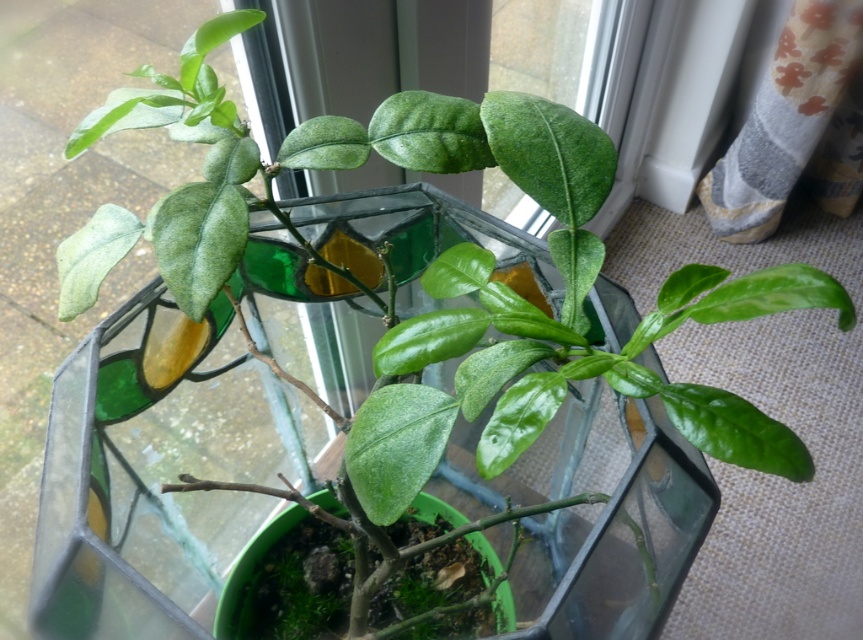
Looking at this image, you are arranging flowers in the green matte glass vase at center and want to place them so they lean toward the window for sunlight. The green glossy leaves at center are in the way. Can you move the flowers to the left side of the vase without blocking the leaves?

The green glossy leaves at center are to the right of the green matte glass vase at center, so moving the flowers to the left side of the vase would not block the leaves.

You are standing in a room and see the green glossy leaves at center and the green matte glass vase at center. Which object is nearer to you?

The green glossy leaves at center are closer to the viewer than the green matte glass vase at center.

You are standing in a room with a potted plant and a decorative glass structure. You notice both the green stained glass at center and the green glossy leaves at center. Which of these two objects is positioned to the left from your viewpoint?

The green stained glass at center is positioned to the left of the green glossy leaves at center.